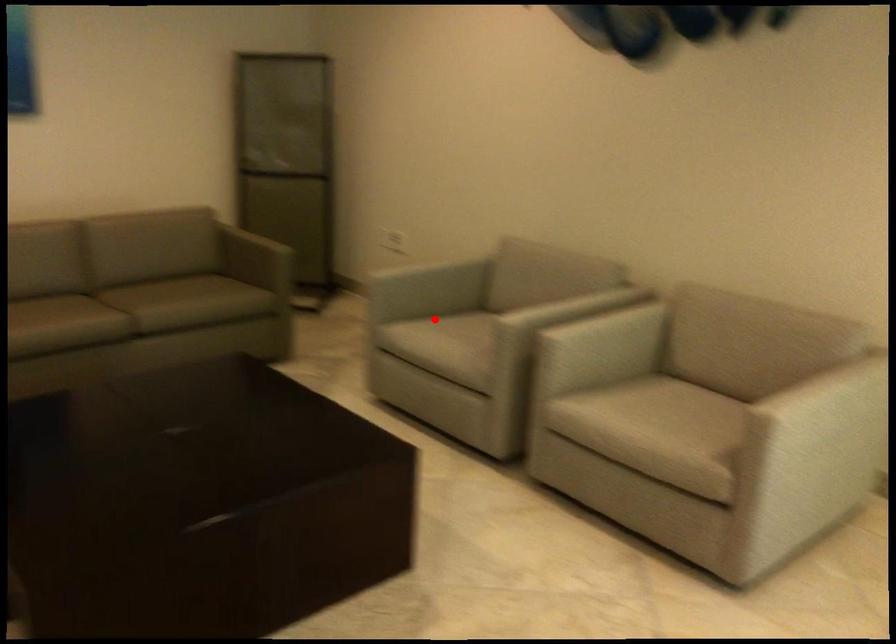
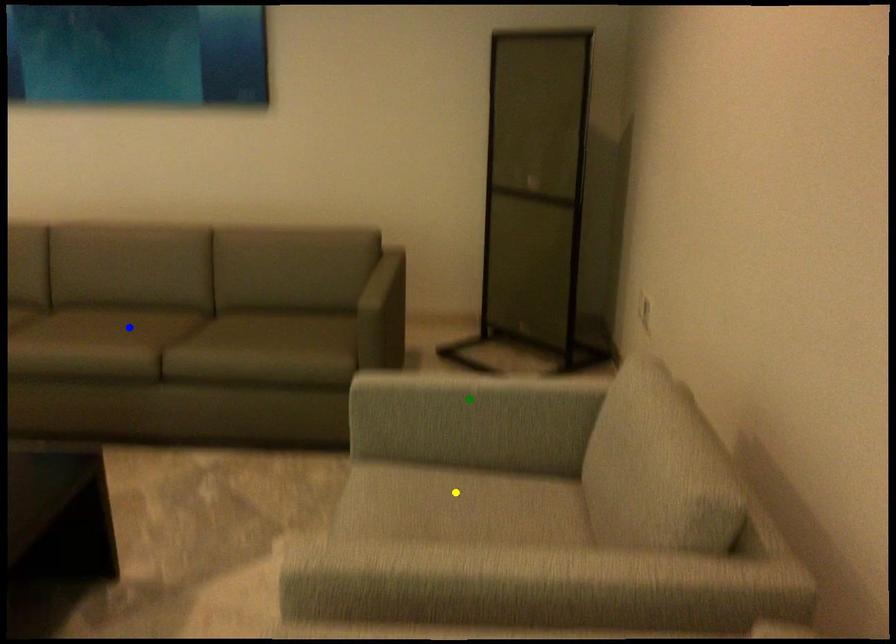
Question: I am providing you with two images of the same scene from different viewpoints. A red point is marked on the first image. You are given multiple points on the second image. Which mark in image 2 goes with the point in image 1?

Choices:
 (A) blue point
 (B) yellow point
 (C) green point

Answer: (B)